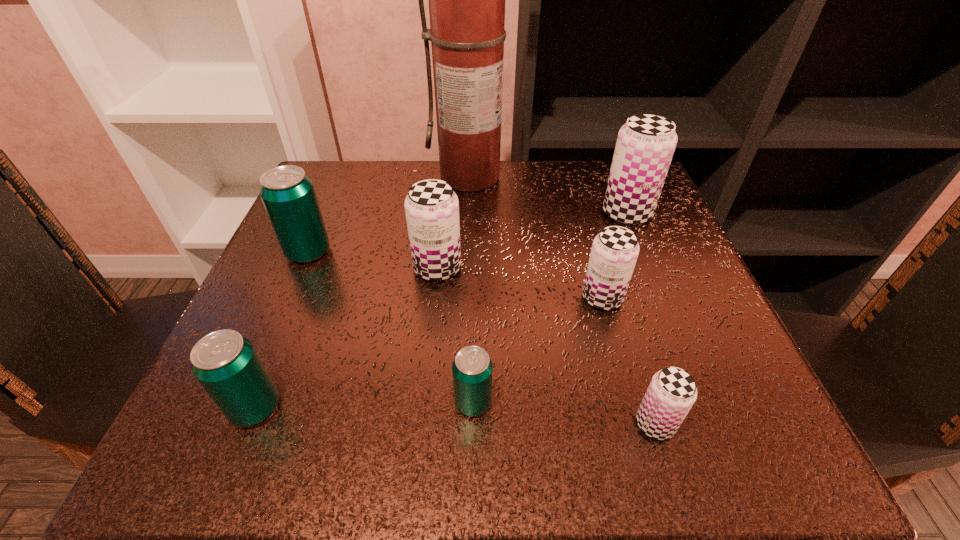
Find the location of `the tallest object`. the tallest object is located at coordinates (466, 0).

The height and width of the screenshot is (540, 960). What are the coordinates of `the farthest object` in the screenshot? It's located at (466, 0).

At what (x,y) coordinates should I click in order to perform the action: click on the farthest beer can. Please return your answer as a coordinate pair (x, y). This screenshot has width=960, height=540. Looking at the image, I should click on (645, 145).

Find the location of `the tallest beer can`. the tallest beer can is located at coordinates (645, 145).

What are the coordinates of `the biggest teal beer can` in the screenshot? It's located at (288, 195).

Find the location of a particular element. The width and height of the screenshot is (960, 540). the second biggest purple beer can is located at coordinates (432, 208).

Where is `the third biggest purple beer can`? the third biggest purple beer can is located at coordinates (615, 250).

Identify the location of the second smallest teal beer can. The width and height of the screenshot is (960, 540). (225, 363).

At what (x,y) coordinates should I click in order to perform the action: click on the smallest purple beer can. Please return your answer as a coordinate pair (x, y). This screenshot has height=540, width=960. Looking at the image, I should click on (672, 391).

Image resolution: width=960 pixels, height=540 pixels. Find the location of `the rightmost teal beer can`. the rightmost teal beer can is located at coordinates (472, 369).